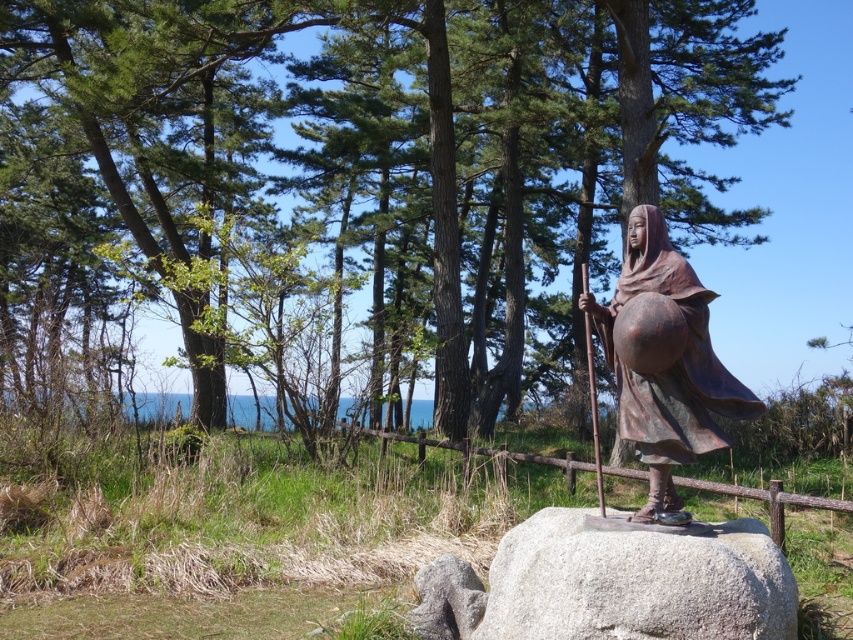
Describe the element at coordinates (636, 582) in the screenshot. This screenshot has width=853, height=640. I see `gray granite boulder at center` at that location.

Is gray granite boulder at center to the right of bronze statue at center from the viewer's perspective?

No, gray granite boulder at center is not to the right of bronze statue at center.

Where is `gray granite boulder at center`? gray granite boulder at center is located at coordinates (636, 582).

Image resolution: width=853 pixels, height=640 pixels. Identify the location of gray granite boulder at center. (636, 582).

Based on the photo, which is more to the left, gray granite boulder at center or brown wooden rail at center?

From the viewer's perspective, gray granite boulder at center appears more on the left side.

Can you confirm if gray granite boulder at center is positioned to the left of brown wooden rail at center?

Yes, gray granite boulder at center is to the left of brown wooden rail at center.

Is point (747, 525) closer to viewer compared to point (608, 474)?

Yes, it is.

The image size is (853, 640). In order to click on gray granite boulder at center in this screenshot , I will do `click(636, 582)`.

Can you confirm if gray granite boulder at center is taller than bronze metallic pole at center?

Incorrect, gray granite boulder at center's height is not larger of bronze metallic pole at center's.

Between point (733, 604) and point (596, 461), which one is positioned in front?

Positioned in front is point (733, 604).

Who is more distant from viewer, [577,557] or [599,472]?

The point [599,472] is behind.

Locate an element on the screen. The image size is (853, 640). gray granite boulder at center is located at coordinates (636, 582).